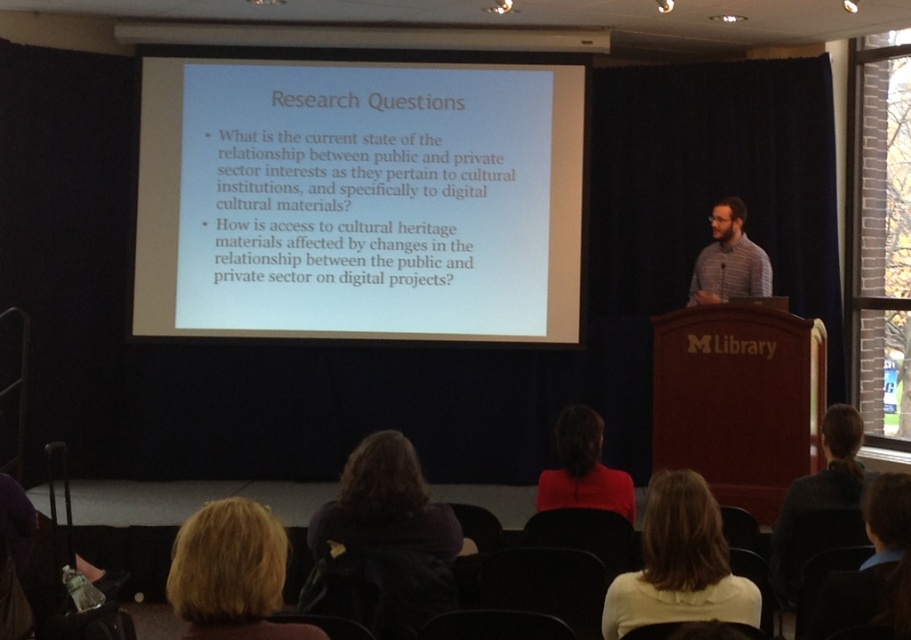
Does white fabric at center appear on the right side of blonde hair at lower left?

Yes, white fabric at center is to the right of blonde hair at lower left.

From the picture: Who is shorter, white fabric at center or blonde hair at lower left?

With less height is blonde hair at lower left.

Measure the distance between point (x=628, y=627) and camera.

2.79 meters

I want to click on white fabric at center, so click(x=679, y=563).

Is dark purple hoodie at lower center to the left of red matte shirt at center from the viewer's perspective?

Correct, you'll find dark purple hoodie at lower center to the left of red matte shirt at center.

Does dark purple hoodie at lower center appear on the right side of red matte shirt at center?

Incorrect, dark purple hoodie at lower center is not on the right side of red matte shirt at center.

You are a GUI agent. You are given a task and a screenshot of the screen. Output one action in this format:
    pyautogui.click(x=<x>, y=<y>)
    Task: Click on the dark purple hoodie at lower center
    The width and height of the screenshot is (911, 640).
    Given the screenshot: What is the action you would take?
    pyautogui.click(x=384, y=541)

Which of these two, white matte projection screen at upper center or striped cotton shirt at upper right, stands shorter?

With less height is striped cotton shirt at upper right.

This screenshot has width=911, height=640. I want to click on white matte projection screen at upper center, so click(x=359, y=200).

The height and width of the screenshot is (640, 911). I want to click on white matte projection screen at upper center, so click(x=359, y=200).